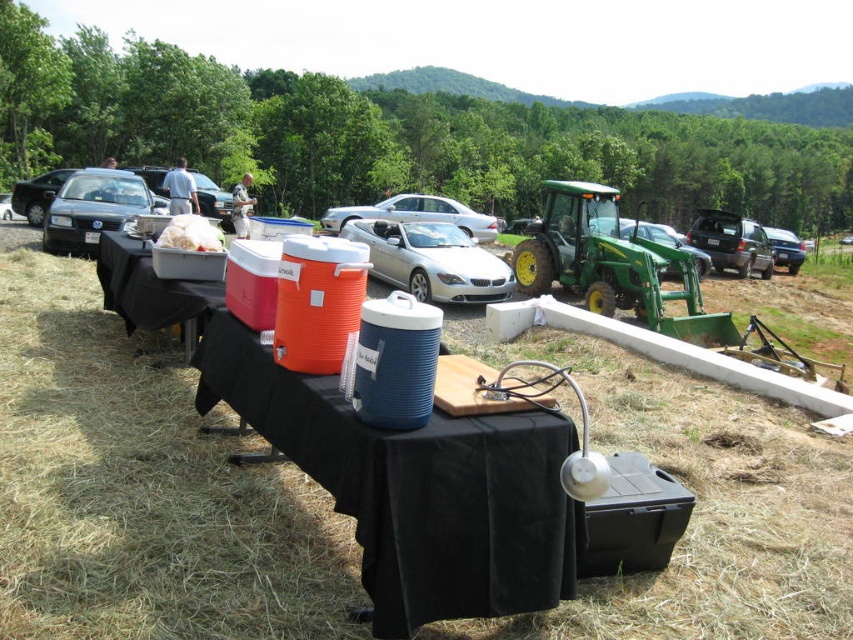
Question: Which point is closer to the camera?

Choices:
 (A) silver metallic car at center
 (B) green grass at lower center
 (C) matte black car at left
 (D) blue plastic cooler at center

Answer: (D)

Question: Can you confirm if green grass at lower center is bigger than blue plastic cooler at center?

Choices:
 (A) yes
 (B) no

Answer: (B)

Question: Is green grass at lower center smaller than green plastic tractor at right?

Choices:
 (A) no
 (B) yes

Answer: (B)

Question: Estimate the real-world distances between objects in this image. Which object is farther from the black plastic table at lower left?

Choices:
 (A) green plastic tractor at right
 (B) silver metallic car at center

Answer: (A)

Question: Which is farther from the blue plastic cooler at center?

Choices:
 (A) black plastic table at lower left
 (B) silver metallic car at center

Answer: (B)

Question: Does green plastic tractor at right have a greater width compared to white fluffy food at center?

Choices:
 (A) yes
 (B) no

Answer: (A)